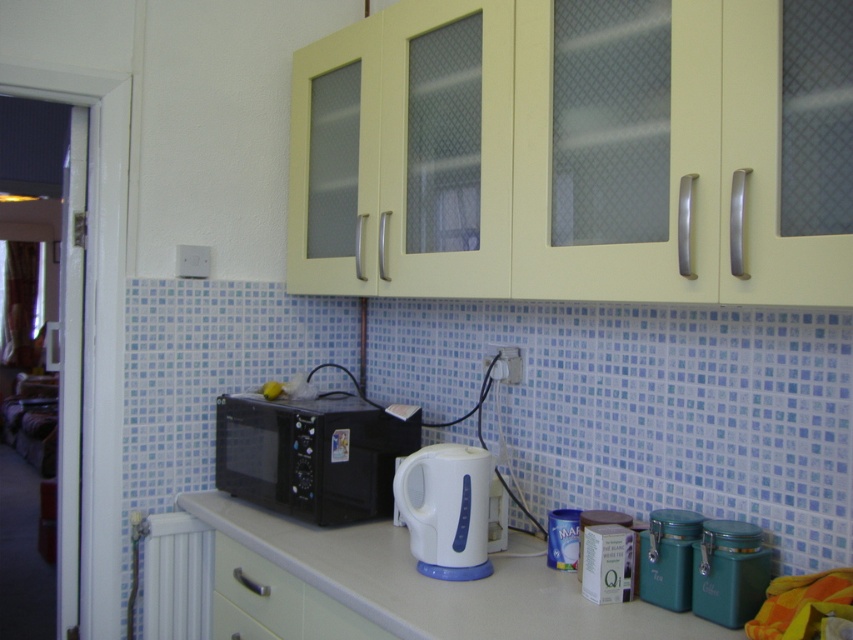
Is black matte microwave at lower center taller than metallic teal canister at lower right?

Yes.

What do you see at coordinates (311, 456) in the screenshot?
I see `black matte microwave at lower center` at bounding box center [311, 456].

At what (x,y) coordinates should I click in order to perform the action: click on black matte microwave at lower center. Please return your answer as a coordinate pair (x, y). This screenshot has width=853, height=640. Looking at the image, I should click on (311, 456).

You are a GUI agent. You are given a task and a screenshot of the screen. Output one action in this format:
    pyautogui.click(x=<x>, y=<y>)
    Task: Click on the black matte microwave at lower center
    The image size is (853, 640).
    Given the screenshot: What is the action you would take?
    pyautogui.click(x=311, y=456)

Can you confirm if white glossy counter at center is wider than black matte microwave at lower center?

Indeed, white glossy counter at center has a greater width compared to black matte microwave at lower center.

Is point (189, 512) positioned in front of point (346, 406)?

No, (189, 512) is behind (346, 406).

Which is in front, point (532, 600) or point (280, 506)?

Point (532, 600)

I want to click on white glossy counter at center, so click(x=439, y=582).

Image resolution: width=853 pixels, height=640 pixels. What are the coordinates of `white plastic kettle at center` in the screenshot? It's located at (445, 509).

Based on the photo, which is above, white plastic kettle at center or green matte drawer at lower center?

white plastic kettle at center is higher up.

Who is more distant from viewer, (456,468) or (227,541)?

The point (227,541) is behind.

Identify the location of white plastic kettle at center. The image size is (853, 640). (445, 509).